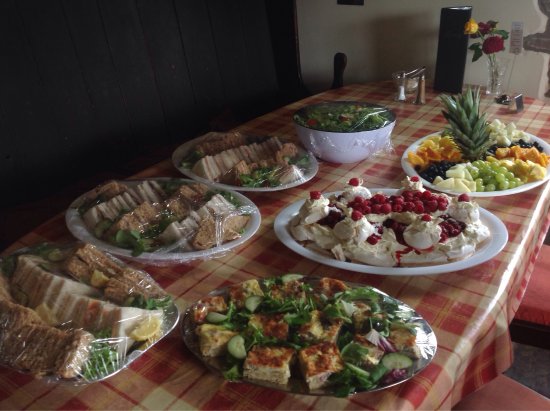
Find the location of a particular element. table is located at coordinates (280, 253).